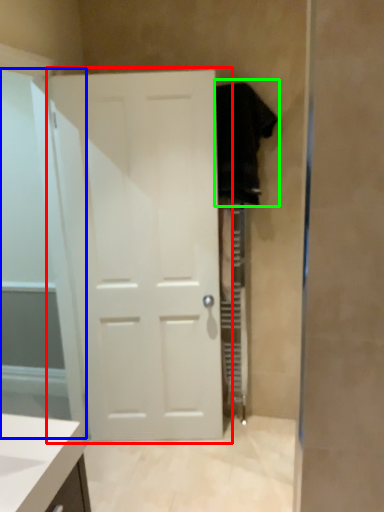
Question: Which is farther away from door (highlighted by a red box)? glass door (highlighted by a blue box) or robe (highlighted by a green box)?

Choices:
 (A) glass door
 (B) robe

Answer: (B)